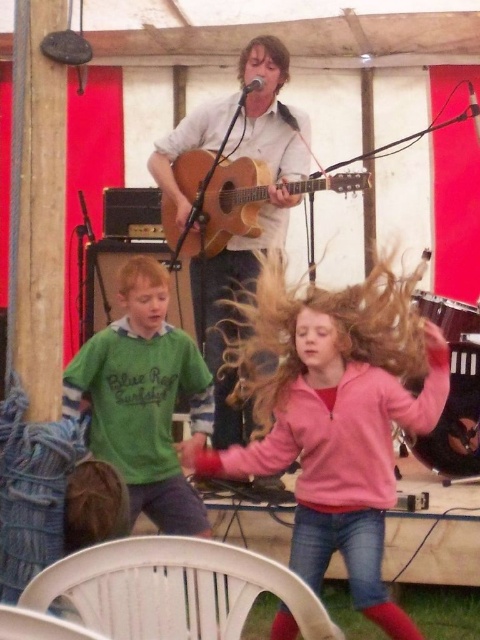
Question: Which of the following is the farthest from the observer?

Choices:
 (A) green matte shirt at left
 (B) acoustic wood guitar at center
 (C) wooden acoustic guitar at center

Answer: (C)

Question: Does wooden acoustic guitar at center have a smaller size compared to acoustic wood guitar at center?

Choices:
 (A) yes
 (B) no

Answer: (B)

Question: Does wooden acoustic guitar at center lie behind blonde silky hair at center?

Choices:
 (A) yes
 (B) no

Answer: (A)

Question: Does pink fleece jacket at center have a larger size compared to acoustic wood guitar at center?

Choices:
 (A) no
 (B) yes

Answer: (B)

Question: Which object is closer to the camera taking this photo?

Choices:
 (A) wooden acoustic guitar at center
 (B) pink fleece jacket at center
 (C) acoustic wood guitar at center
 (D) blonde silky hair at center

Answer: (B)

Question: Which point is closer to the camera taking this photo?

Choices:
 (A) (324, 541)
 (B) (224, 369)

Answer: (A)